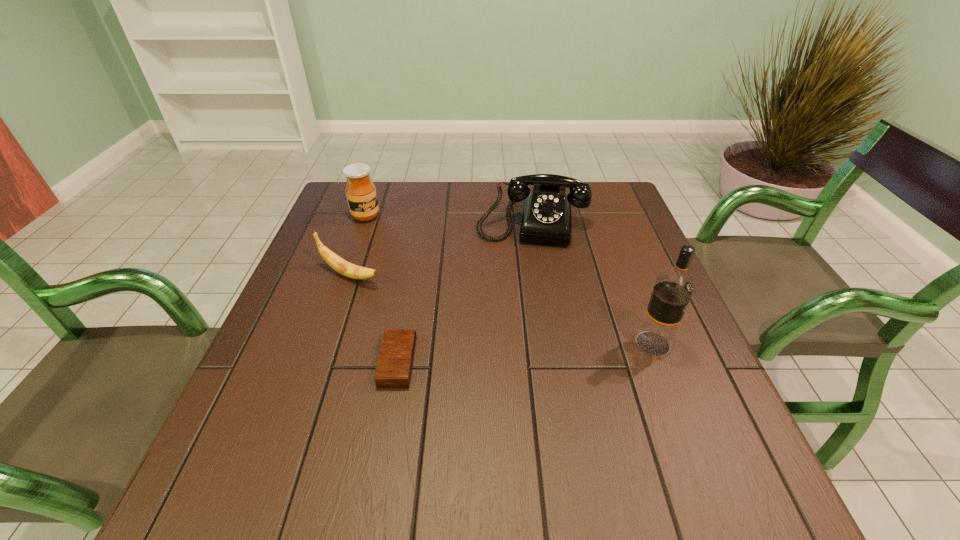
Find the location of `free space located on the dial of the telephone`. free space located on the dial of the telephone is located at coordinates (515, 342).

I want to click on vacant area situated on the dial of the telephone, so click(513, 365).

At what (x,y) coordinates should I click in order to perform the action: click on free location located on the front-facing side of the honey. Please return your answer as a coordinate pair (x, y). Looking at the image, I should click on (407, 246).

Find the location of a particular element. The image size is (960, 540). vacant space situated on the front-facing side of the honey is located at coordinates (390, 234).

You are a GUI agent. You are given a task and a screenshot of the screen. Output one action in this format:
    pyautogui.click(x=<x>, y=<y>)
    Task: Click on the free region located on the front-facing side of the honey
    This screenshot has width=960, height=540.
    Given the screenshot: What is the action you would take?
    pyautogui.click(x=468, y=290)

Image resolution: width=960 pixels, height=540 pixels. In order to click on vacant space situated 0.150m on the peel of the banana from the top in this screenshot , I will do `click(427, 305)`.

At what (x,y) coordinates should I click in order to perform the action: click on vacant space located on the peel of the banana from the top. Please return your answer as a coordinate pair (x, y). The width and height of the screenshot is (960, 540). Looking at the image, I should click on (496, 334).

Identify the location of vacant area situated on the peel of the banana from the top. This screenshot has height=540, width=960. (420, 301).

The height and width of the screenshot is (540, 960). Find the location of `telephone that is at the far edge`. telephone that is at the far edge is located at coordinates (546, 217).

The image size is (960, 540). I want to click on honey situated at the far edge, so click(361, 194).